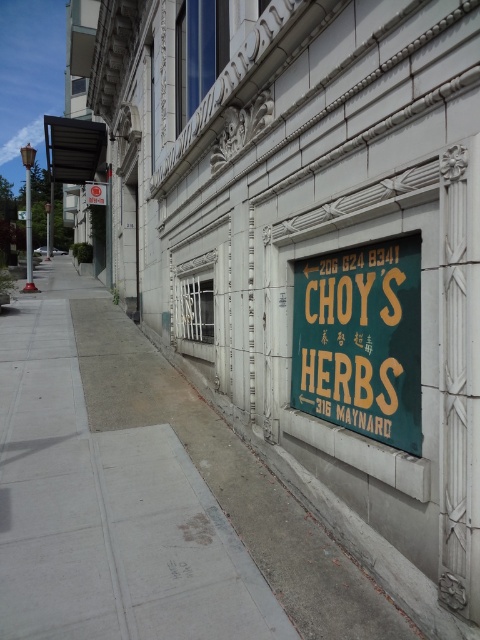
The width and height of the screenshot is (480, 640). What do you see at coordinates (146, 497) in the screenshot?
I see `gray concrete sidewalk at lower left` at bounding box center [146, 497].

Does gray concrete sidewalk at lower left appear on the right side of green matte sign at center?

In fact, gray concrete sidewalk at lower left is to the left of green matte sign at center.

Which is in front, point (222, 436) or point (311, 269)?

Point (311, 269) is in front.

Find the location of `gray concrete sidewalk at lower left`. gray concrete sidewalk at lower left is located at coordinates (146, 497).